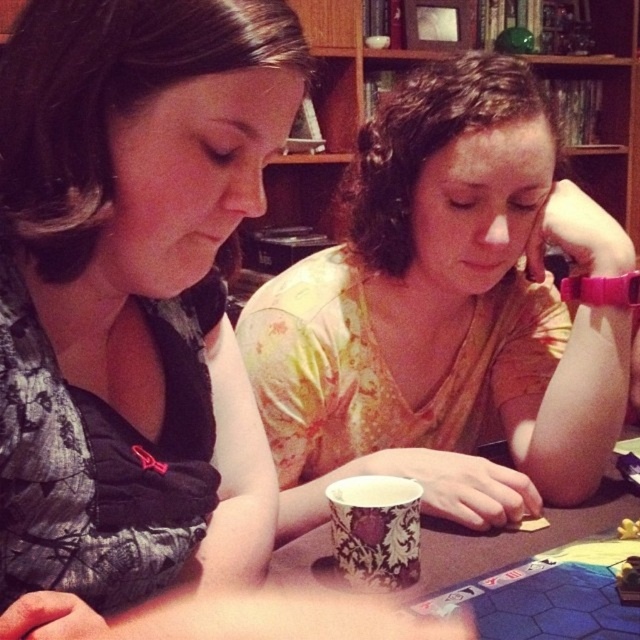
How much distance is there between matte yellow shirt at center and white paper cup at center?

matte yellow shirt at center is 6.78 inches away from white paper cup at center.

Between matte yellow shirt at center and white paper cup at center, which one is positioned higher?

matte yellow shirt at center is above.

Is point (472, 93) closer to camera compared to point (486, 449)?

Yes, point (472, 93) is closer to viewer.

Image resolution: width=640 pixels, height=640 pixels. Identify the location of matte yellow shirt at center. (445, 314).

Who is taller, matte floral shirt at center or white paper cup at center?

matte floral shirt at center is taller.

Describe the element at coordinates (141, 324) in the screenshot. I see `matte floral shirt at center` at that location.

This screenshot has width=640, height=640. In order to click on matte floral shirt at center in this screenshot , I will do `click(141, 324)`.

Can you confirm if matte floral shirt at center is wider than matte yellow shirt at center?

Incorrect, matte floral shirt at center's width does not surpass matte yellow shirt at center's.

The height and width of the screenshot is (640, 640). Identify the location of matte floral shirt at center. (141, 324).

Between point (193, 244) and point (477, 273), which one is positioned in front?

Point (193, 244) is more forward.

This screenshot has height=640, width=640. Identify the location of matte floral shirt at center. (141, 324).